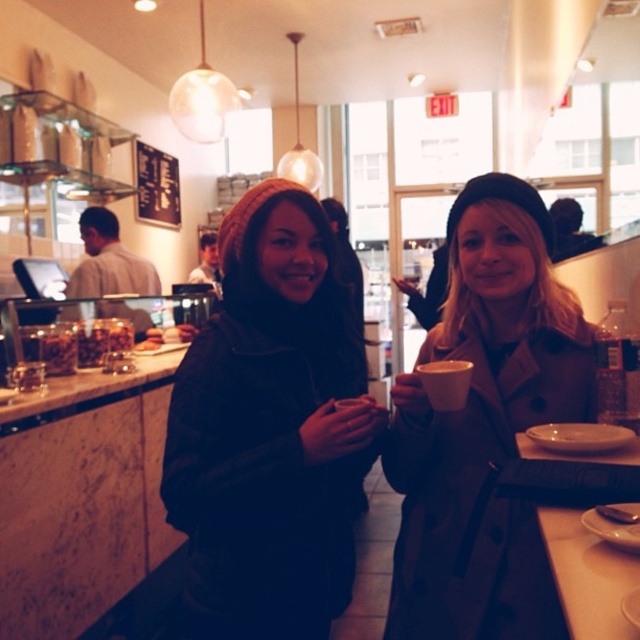
You are a customer in the cozy cafe and want to touch the matte gray coat at center. The point you need to touch is located at coordinates point (484, 426). Can you confirm if this point is on the matte gray coat at center?

Yes, the point (484, 426) is on the matte gray coat at center according to the description.

You are a barista working behind the counter and want to hand a customer a drink. The customer is wearing the matte black beanie at center. If you can reach 40 inches, can you reach them from your current position?

The matte black beanie at center and viewer are 37.70 inches apart from each other. Since your reach is 40 inches, you can reach the customer wearing the matte black beanie at center from your current position.

You are a customer at the cafe and want to take a photo of the matte black beanie at center and the matte gray coat at center. Which object should you focus on first if you want to capture both in one shot without moving the camera?

The matte black beanie at center is located below the matte gray coat at center, so you should focus on the matte gray coat at center first since it is higher up and ensure the camera frame includes both objects by adjusting the zoom or composition.